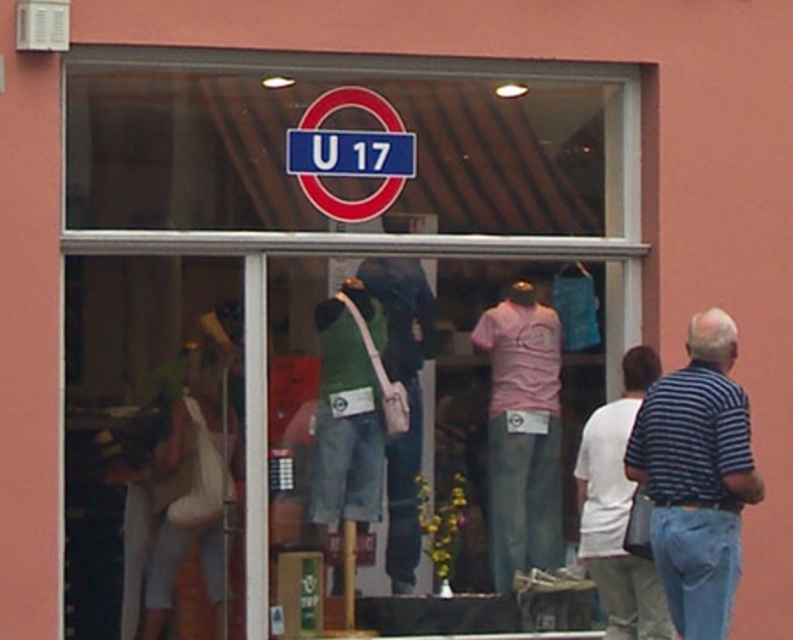
Is striped cotton shirt at right positioned before white cotton t-shirt at right?

Yes, striped cotton shirt at right is in front of white cotton t-shirt at right.

How much distance is there between striped cotton shirt at right and white cotton t-shirt at right?

The distance of striped cotton shirt at right from white cotton t-shirt at right is 29.34 inches.

This screenshot has height=640, width=793. What do you see at coordinates (696, 476) in the screenshot? I see `striped cotton shirt at right` at bounding box center [696, 476].

Find the location of a particular element. This screenshot has height=640, width=793. striped cotton shirt at right is located at coordinates (696, 476).

Is transparent glass at center thinner than white cotton t-shirt at right?

No.

Does transparent glass at center appear on the left side of white cotton t-shirt at right?

Indeed, transparent glass at center is positioned on the left side of white cotton t-shirt at right.

What do you see at coordinates (328, 326) in the screenshot?
I see `transparent glass at center` at bounding box center [328, 326].

At what (x,y) coordinates should I click in order to perform the action: click on transparent glass at center. Please return your answer as a coordinate pair (x, y). Looking at the image, I should click on (328, 326).

Can you confirm if transparent glass at center is shorter than striped cotton shirt at right?

No, transparent glass at center is not shorter than striped cotton shirt at right.

You are a GUI agent. You are given a task and a screenshot of the screen. Output one action in this format:
    pyautogui.click(x=<x>, y=<y>)
    Task: Click on the transparent glass at center
    This screenshot has width=793, height=640.
    Given the screenshot: What is the action you would take?
    pyautogui.click(x=328, y=326)

Describe the element at coordinates (328, 326) in the screenshot. I see `transparent glass at center` at that location.

I want to click on transparent glass at center, so click(x=328, y=326).